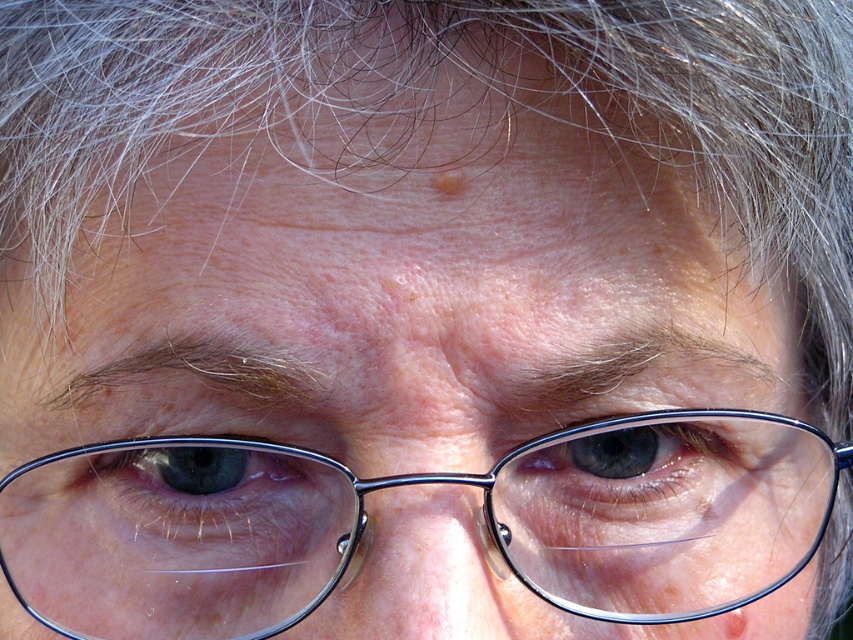
Question: Does matte metal eye at center lie in front of matte blue eye at center?

Choices:
 (A) yes
 (B) no

Answer: (B)

Question: In this image, where is matte metal eye at center located relative to matte blue eye at center?

Choices:
 (A) right
 (B) left

Answer: (A)

Question: Considering the real-world distances, which object is closest to the matte blue eye at center?

Choices:
 (A) metallic frame glasses at center
 (B) matte metal eye at center

Answer: (A)

Question: Estimate the real-world distances between objects in this image. Which object is farther from the matte blue eye at center?

Choices:
 (A) matte metal eye at center
 (B) metallic frame glasses at center

Answer: (A)

Question: Which of the following is the farthest from the observer?

Choices:
 (A) matte blue eye at center
 (B) metallic frame glasses at center
 (C) matte metal eye at center

Answer: (C)

Question: Is matte metal eye at center to the right of matte blue eye at center from the viewer's perspective?

Choices:
 (A) yes
 (B) no

Answer: (A)